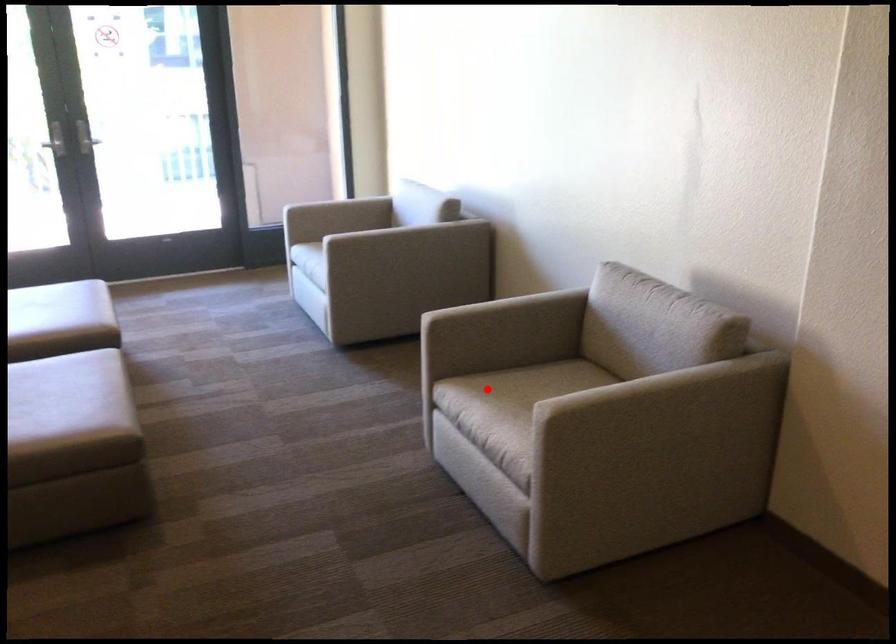
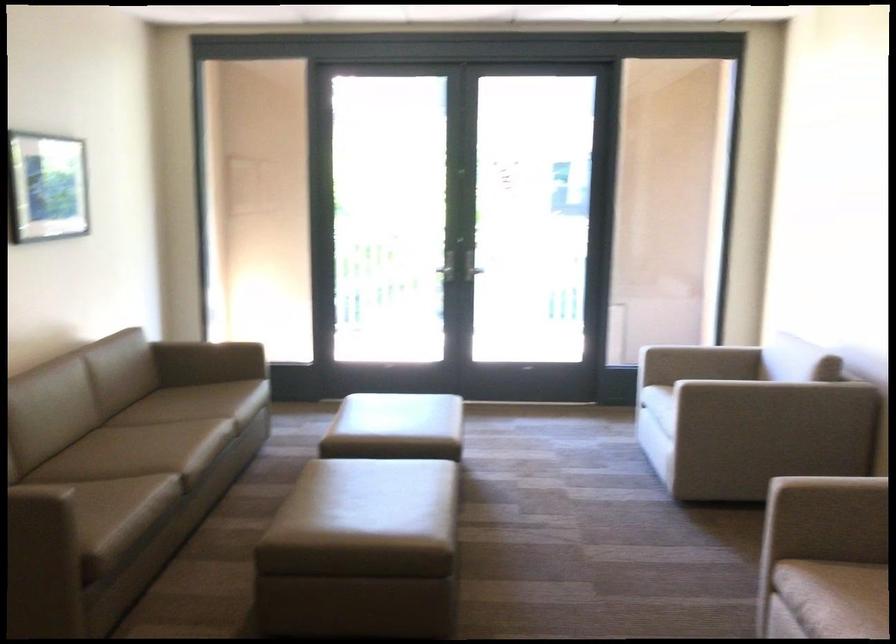
Question: A red point is marked in image1. In image2, is the corresponding 3D point closer to the camera or farther? Reply with the corresponding letter.

Choices:
 (A) The corresponding 3D point is closer.
 (B) The corresponding 3D point is farther.

Answer: (A)